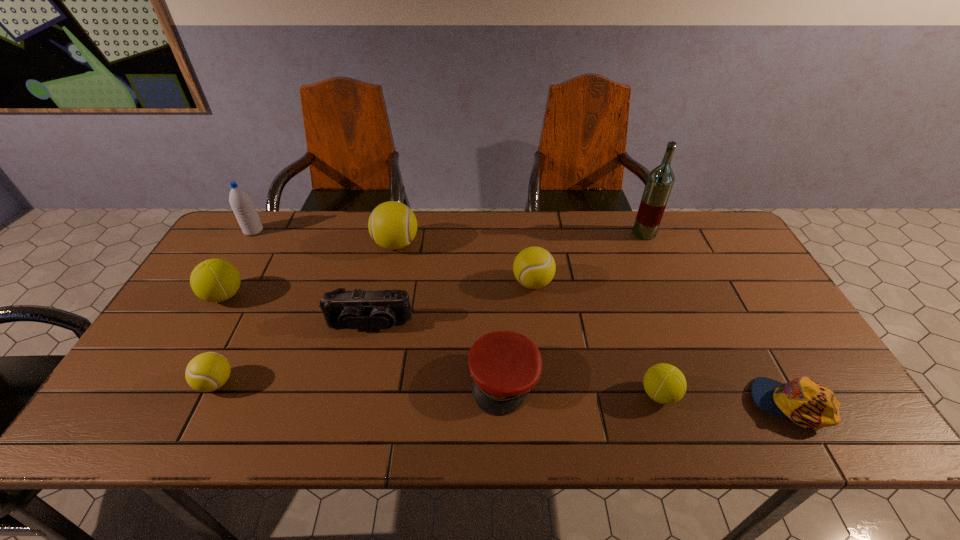
The width and height of the screenshot is (960, 540). I want to click on camcorder, so click(353, 309).

Where is `the nearest yellow tennis ball`? This screenshot has height=540, width=960. the nearest yellow tennis ball is located at coordinates (209, 371).

You are a GUI agent. You are given a task and a screenshot of the screen. Output one action in this format:
    pyautogui.click(x=<x>, y=<y>)
    Task: Click on the smallest yellow tennis ball
    The height and width of the screenshot is (540, 960).
    Given the screenshot: What is the action you would take?
    pyautogui.click(x=209, y=371)

This screenshot has width=960, height=540. I want to click on the nearer green tennis ball, so click(664, 383).

Where is `the smaller green tennis ball`? the smaller green tennis ball is located at coordinates (664, 383).

I want to click on the left cap, so [504, 365].

Where is `the rightmost object`? the rightmost object is located at coordinates point(803,401).

Find the location of `vacant area situated 0.120m on the left of the ninth object from left to right`. vacant area situated 0.120m on the left of the ninth object from left to right is located at coordinates (596, 233).

I want to click on blank area located 0.170m on the right of the water bottle, so click(x=314, y=231).

Where is `vacant space situated on the front of the eighth shortest object`? Image resolution: width=960 pixels, height=540 pixels. vacant space situated on the front of the eighth shortest object is located at coordinates (382, 308).